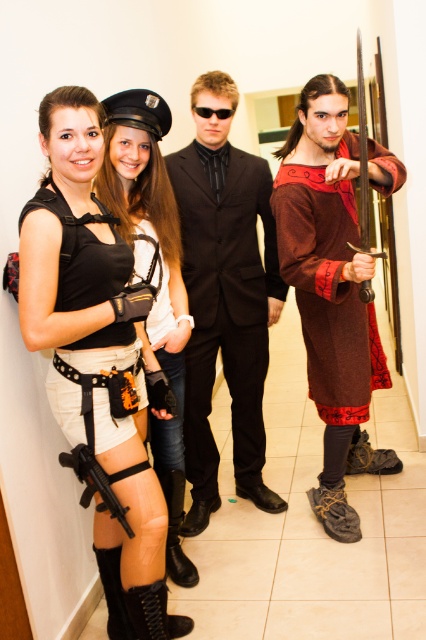
Where is the black leather shorts at lower left located in the image?

The black leather shorts at lower left is located at point (97,356).

You are a photographer standing in the hallway. You want to take a photo that includes both the matte black vest at left and the black plastic goggles at center. What is the minimum distance you need to move backward to ensure both objects are in frame?

The minimum distance you need to move backward is 31.62 inches to ensure both the matte black vest at left and the black plastic goggles at center are in frame since they are 31.62 inches apart from each other.